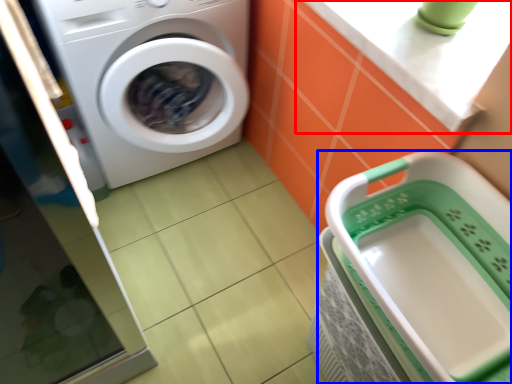
Question: Among these objects, which one is farthest to the camera, counter top (highlighted by a red box) or dish washer (highlighted by a blue box)?

Choices:
 (A) counter top
 (B) dish washer

Answer: (A)